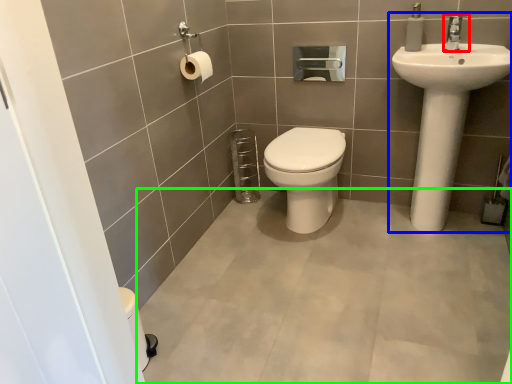
Question: Which object is positioned farthest from tap (highlighted by a red box)? Select from sink (highlighted by a blue box) and plain (highlighted by a green box).

Choices:
 (A) sink
 (B) plain

Answer: (B)